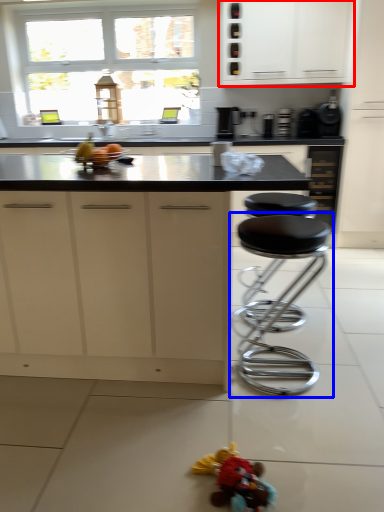
Question: Which object is further to the camera taking this photo, cabinetry (highlighted by a red box) or stool (highlighted by a blue box)?

Choices:
 (A) cabinetry
 (B) stool

Answer: (A)